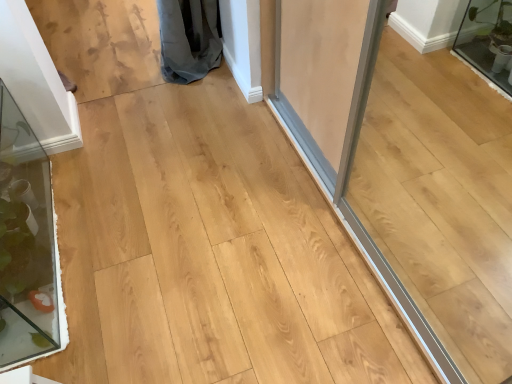
Find the location of a particular element. vacant area that lies to the right of transparent glass at left is located at coordinates (161, 240).